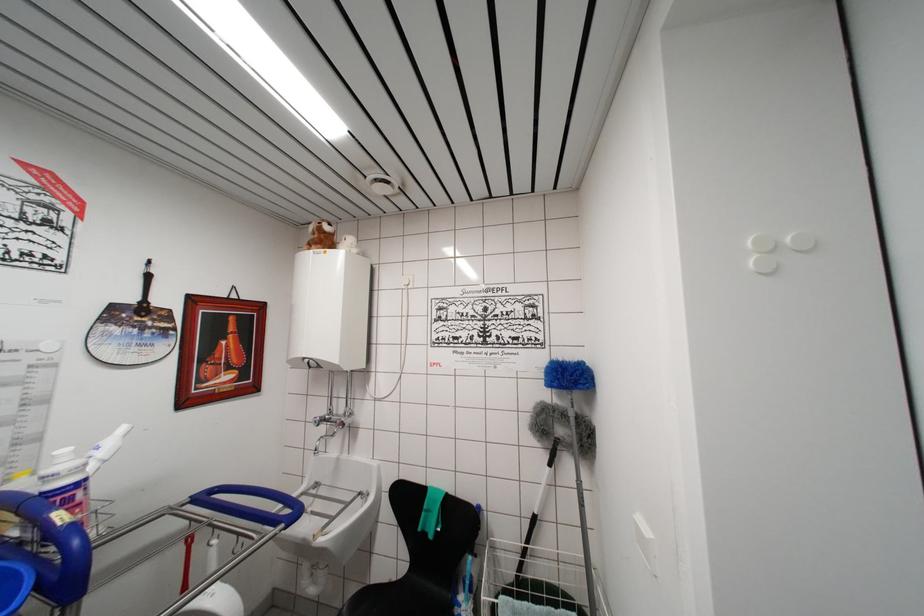
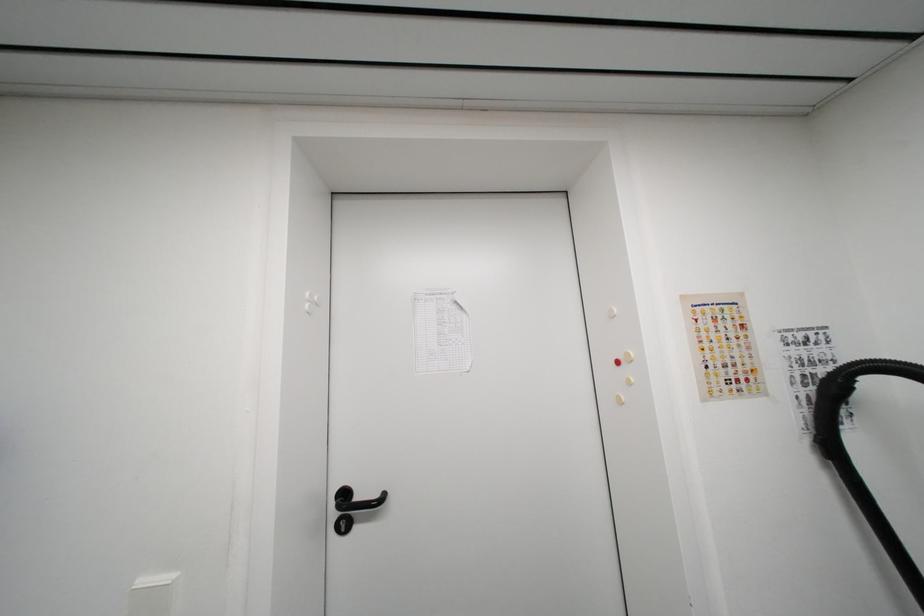
Question: How did the camera likely rotate?

Choices:
 (A) Left
 (B) Right
 (C) Up
 (D) Down

Answer: (B)